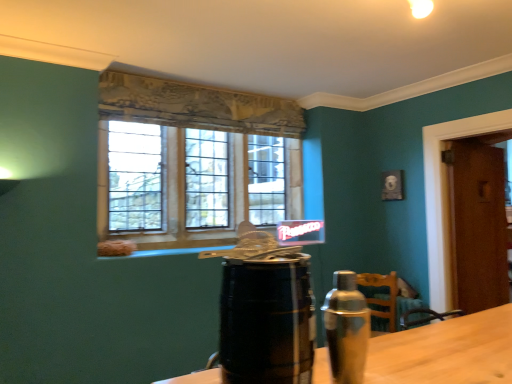
Question: Can you confirm if silver metallic shaker at right is bigger than brown wooden door at right?

Choices:
 (A) yes
 (B) no

Answer: (B)

Question: From the image's perspective, is silver metallic shaker at right located beneath brown wooden door at right?

Choices:
 (A) no
 (B) yes

Answer: (A)

Question: Can you confirm if silver metallic shaker at right is shorter than brown wooden door at right?

Choices:
 (A) no
 (B) yes

Answer: (B)

Question: Can you confirm if silver metallic shaker at right is smaller than brown wooden door at right?

Choices:
 (A) yes
 (B) no

Answer: (A)

Question: Is silver metallic shaker at right positioned before brown wooden door at right?

Choices:
 (A) yes
 (B) no

Answer: (A)

Question: Does silver metallic shaker at right have a greater width compared to brown wooden door at right?

Choices:
 (A) no
 (B) yes

Answer: (A)

Question: Is the depth of silver metallic shaker at right less than that of clear glass window at center?

Choices:
 (A) yes
 (B) no

Answer: (A)

Question: Is silver metallic shaker at right smaller than clear glass window at center?

Choices:
 (A) no
 (B) yes

Answer: (B)

Question: From a real-world perspective, is silver metallic shaker at right located beneath clear glass window at center?

Choices:
 (A) yes
 (B) no

Answer: (A)

Question: Considering the relative sizes of silver metallic shaker at right and clear glass window at center in the image provided, is silver metallic shaker at right bigger than clear glass window at center?

Choices:
 (A) yes
 (B) no

Answer: (B)

Question: Is silver metallic shaker at right shorter than clear glass window at center?

Choices:
 (A) yes
 (B) no

Answer: (A)

Question: Could clear glass window at center be considered to be inside silver metallic shaker at right?

Choices:
 (A) no
 (B) yes

Answer: (A)

Question: Is clear glass window at center closer to camera compared to black wooden barrel at center?

Choices:
 (A) yes
 (B) no

Answer: (B)